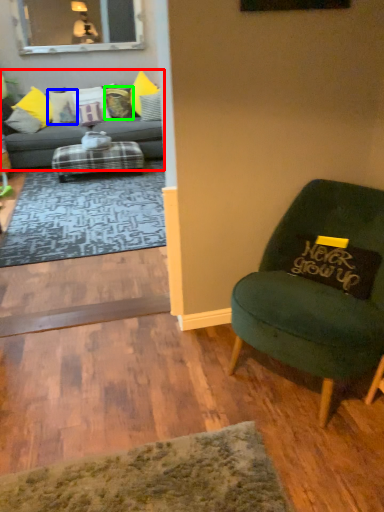
Question: Which object is positioned farthest from studio couch (highlighted by a red box)? Select from pillow (highlighted by a blue box) and pillow (highlighted by a green box).

Choices:
 (A) pillow
 (B) pillow

Answer: (B)